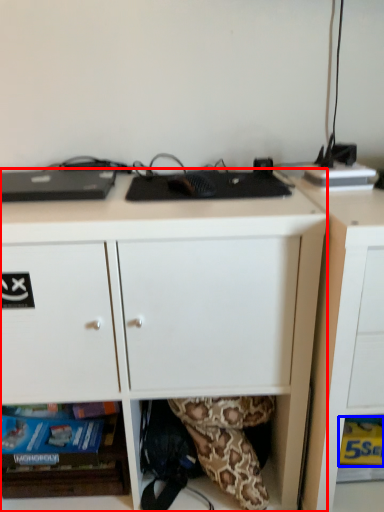
Question: Among these objects, which one is nearest to the camera, desk (highlighted by a red box) or paperback book (highlighted by a blue box)?

Choices:
 (A) desk
 (B) paperback book

Answer: (A)